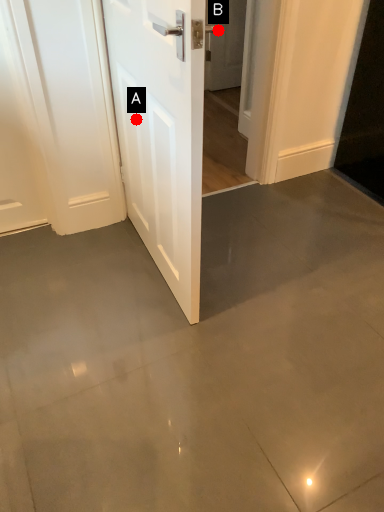
Question: Two points are circled on the image, labeled by A and B beside each circle. Among these points, which one is farthest from the camera?

Choices:
 (A) A is further
 (B) B is further

Answer: (B)